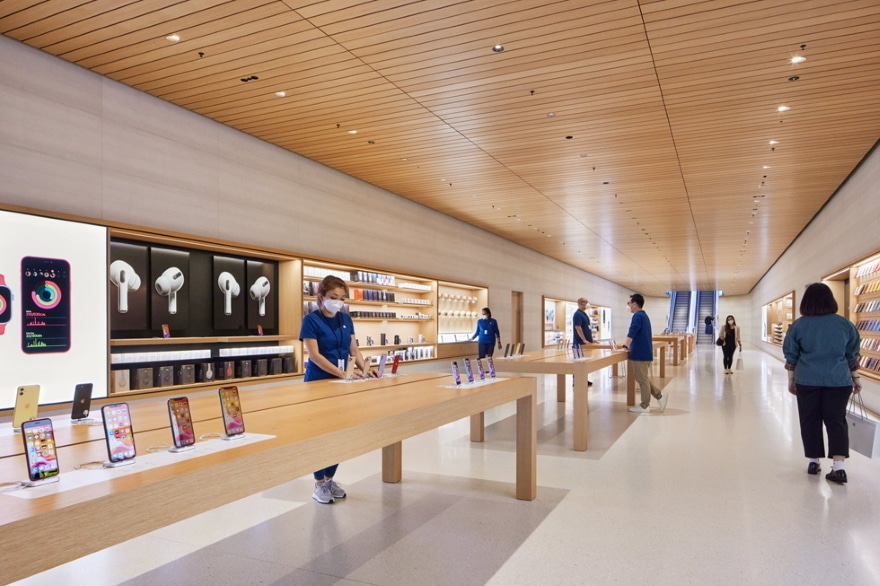
The width and height of the screenshot is (880, 586). What are the coordinates of `phone` in the screenshot? It's located at (41, 434).